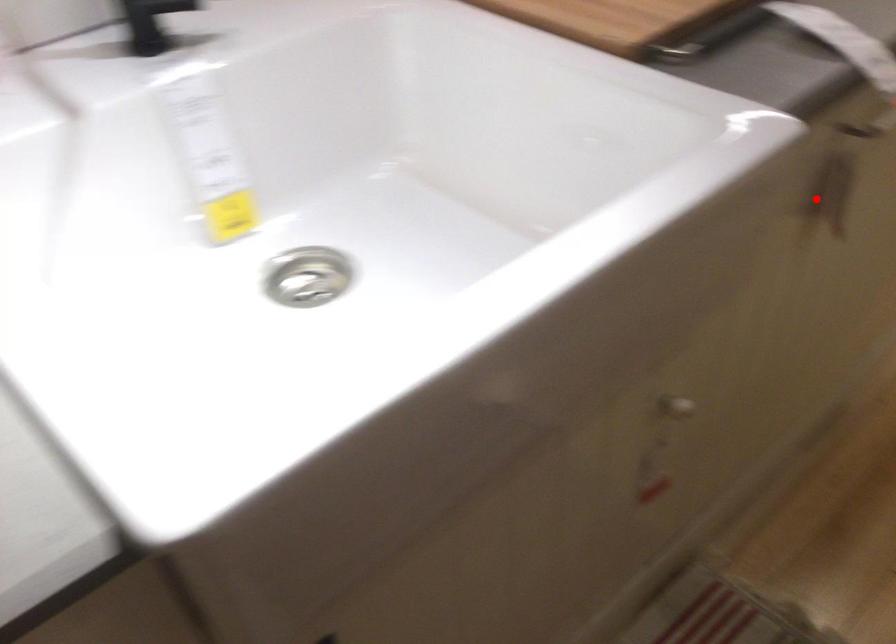
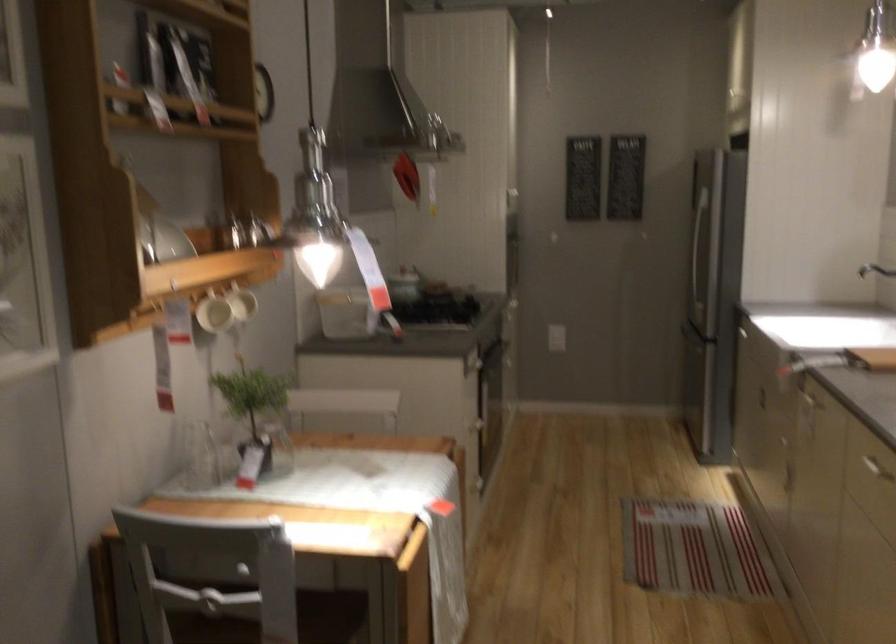
In the second image, find the point that corresponds to the highlighted location in the first image.

(810, 391)